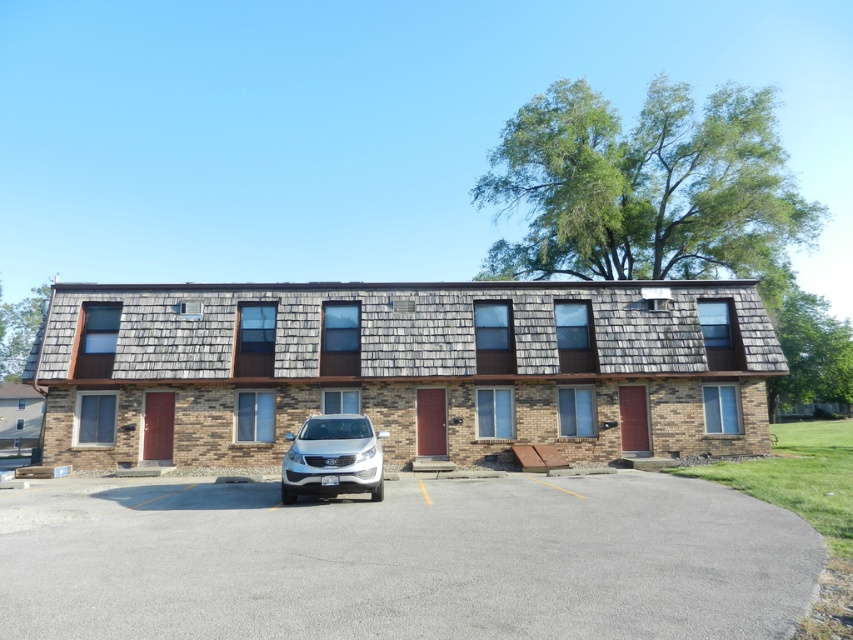
Question: Is gray asphalt parking lot at center further to camera compared to white matte suv at center?

Choices:
 (A) no
 (B) yes

Answer: (A)

Question: In this image, where is gray asphalt parking lot at center located relative to white matte suv at center?

Choices:
 (A) right
 (B) left

Answer: (A)

Question: Among these objects, which one is farthest from the camera?

Choices:
 (A) white matte suv at center
 (B) gray asphalt parking lot at center

Answer: (A)

Question: Does gray asphalt parking lot at center have a greater width compared to white matte suv at center?

Choices:
 (A) yes
 (B) no

Answer: (A)

Question: Which point is farther from the camera taking this photo?

Choices:
 (A) (641, 636)
 (B) (351, 480)

Answer: (B)